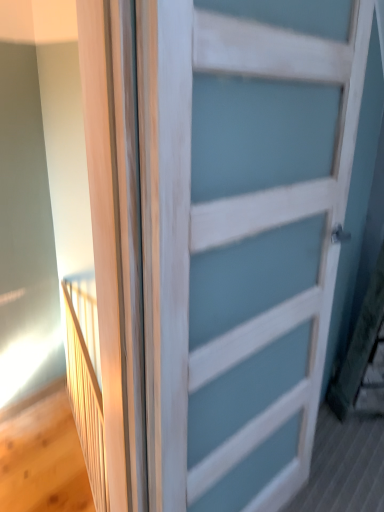
Question: Looking at their shapes, would you say white matte door at center is wider or thinner than wooden elevator at left?

Choices:
 (A) thin
 (B) wide

Answer: (B)

Question: Would you say white matte door at center is inside or outside wooden elevator at left?

Choices:
 (A) outside
 (B) inside

Answer: (A)

Question: Visually, is white matte door at center positioned to the left or to the right of wooden elevator at left?

Choices:
 (A) left
 (B) right

Answer: (B)

Question: Visually, is wooden elevator at left positioned to the left or to the right of white matte door at center?

Choices:
 (A) right
 (B) left

Answer: (B)

Question: Is point (99, 425) closer or farther from the camera than point (185, 325)?

Choices:
 (A) closer
 (B) farther

Answer: (B)

Question: From their relative heights in the image, would you say wooden elevator at left is taller or shorter than white matte door at center?

Choices:
 (A) short
 (B) tall

Answer: (A)

Question: In terms of width, does wooden elevator at left look wider or thinner when compared to white matte door at center?

Choices:
 (A) wide
 (B) thin

Answer: (B)